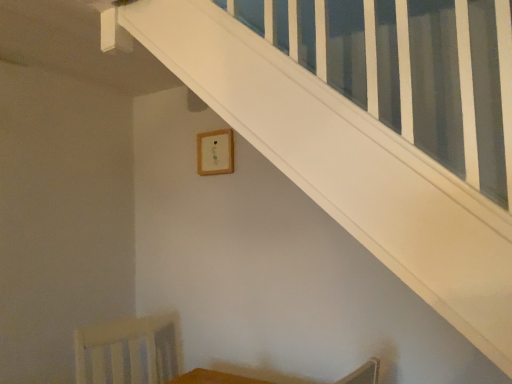
What is the approximate width of white wood swivel chair at lower left?

white wood swivel chair at lower left is 23.40 inches in width.

What is the approximate height of wooden table at lower center?

wooden table at lower center is 8.64 centimeters tall.

This screenshot has width=512, height=384. I want to click on white wood swivel chair at lower left, so click(130, 351).

Between wooden table at lower center and white wood swivel chair at lower left, which one is positioned behind?

white wood swivel chair at lower left.

Image resolution: width=512 pixels, height=384 pixels. What are the coordinates of `furniture on the right side of white wood swivel chair at lower left` in the screenshot? It's located at (213, 378).

From the image's perspective, is wooden table at lower center located beneath white wood swivel chair at lower left?

No.

Is wooden table at lower center situated inside white wood swivel chair at lower left or outside?

wooden table at lower center exists outside the volume of white wood swivel chair at lower left.

Does wooden table at lower center turn towards wooden frame at upper center?

No, wooden table at lower center is not facing towards wooden frame at upper center.

Is wooden table at lower center in contact with wooden frame at upper center?

wooden table at lower center and wooden frame at upper center are clearly separated.

Does wooden table at lower center appear on the right side of wooden frame at upper center?

Correct, you'll find wooden table at lower center to the right of wooden frame at upper center.

Considering the positions of point (215, 373) and point (209, 164), is point (215, 373) closer or farther from the camera than point (209, 164)?

Point (215, 373).

From a real-world perspective, is wooden frame at upper center above or below wooden table at lower center?

wooden frame at upper center is situated higher than wooden table at lower center in the real world.

Is wooden frame at upper center to the left or to the right of wooden table at lower center in the image?

Based on their positions, wooden frame at upper center is located to the left of wooden table at lower center.

Is wooden frame at upper center aimed at wooden table at lower center?

No, wooden frame at upper center is not aimed at wooden table at lower center.

Is wooden frame at upper center bigger than wooden table at lower center?

Actually, wooden frame at upper center might be smaller than wooden table at lower center.

Which of these two, wooden frame at upper center or white wood swivel chair at lower left, is smaller?

wooden frame at upper center is smaller.

How different are the orientations of wooden frame at upper center and white wood swivel chair at lower left in degrees?

78.3 degrees separate the facing orientations of wooden frame at upper center and white wood swivel chair at lower left.

Is wooden frame at upper center to the left of white wood swivel chair at lower left from the viewer's perspective?

Incorrect, wooden frame at upper center is not on the left side of white wood swivel chair at lower left.

You are a GUI agent. You are given a task and a screenshot of the screen. Output one action in this format:
    pyautogui.click(x=<x>, y=<y>)
    Task: Click on the picture frame behind the white wood swivel chair at lower left
    The image size is (512, 384).
    Given the screenshot: What is the action you would take?
    pyautogui.click(x=215, y=152)

Locate an element on the screen. This screenshot has width=512, height=384. furniture located above the white wood swivel chair at lower left (from a real-world perspective) is located at coordinates (213, 378).

Looking at this image, from a real-world perspective, between white wood swivel chair at lower left and wooden table at lower center, who is vertically higher?

From a 3D spatial view, wooden table at lower center is above.

How much distance is there between white wood swivel chair at lower left and wooden table at lower center?

white wood swivel chair at lower left is 13.77 inches from wooden table at lower center.

From the image's perspective, which one is positioned lower, white wood swivel chair at lower left or wooden table at lower center?

white wood swivel chair at lower left appears lower in the image.

How many degrees apart are the facing directions of white wood swivel chair at lower left and wooden frame at upper center?

There is a 78.3-degree angle between the facing directions of white wood swivel chair at lower left and wooden frame at upper center.

Could wooden frame at upper center be considered to be inside white wood swivel chair at lower left?

That's incorrect, wooden frame at upper center is not inside white wood swivel chair at lower left.

Which object is further away from the camera, white wood swivel chair at lower left or wooden frame at upper center?

wooden frame at upper center is more distant.

Does white wood swivel chair at lower left have a larger size compared to wooden frame at upper center?

Correct, white wood swivel chair at lower left is larger in size than wooden frame at upper center.

You are a GUI agent. You are given a task and a screenshot of the screen. Output one action in this format:
    pyautogui.click(x=<x>, y=<y>)
    Task: Click on the furniture above the white wood swivel chair at lower left (from a real-world perspective)
    This screenshot has height=384, width=512.
    Given the screenshot: What is the action you would take?
    pyautogui.click(x=213, y=378)

This screenshot has width=512, height=384. I want to click on furniture below the wooden frame at upper center (from a real-world perspective), so click(213, 378).

Looking at the image, which one is located closer to wooden frame at upper center, white wood swivel chair at lower left or wooden table at lower center?

Based on the image, white wood swivel chair at lower left appears to be nearer to wooden frame at upper center.

Which object lies nearer to the anchor point wooden table at lower center, white wood swivel chair at lower left or wooden frame at upper center?

Based on the image, white wood swivel chair at lower left appears to be nearer to wooden table at lower center.

Considering their positions, is wooden table at lower center positioned further to white wood swivel chair at lower left than wooden frame at upper center?

Based on the image, wooden frame at upper center appears to be further to white wood swivel chair at lower left.

When comparing their distances from wooden frame at upper center, does wooden table at lower center or white wood swivel chair at lower left seem closer?

The object closer to wooden frame at upper center is white wood swivel chair at lower left.

When comparing their distances from wooden table at lower center, does wooden frame at upper center or white wood swivel chair at lower left seem closer?

Among the two, white wood swivel chair at lower left is located nearer to wooden table at lower center.

Which object lies nearer to the anchor point white wood swivel chair at lower left, wooden frame at upper center or wooden table at lower center?

wooden table at lower center lies closer to white wood swivel chair at lower left than the other object.

The height and width of the screenshot is (384, 512). What are the coordinates of `furniture between wooden frame at upper center and white wood swivel chair at lower left in the up-down direction` in the screenshot? It's located at (213, 378).